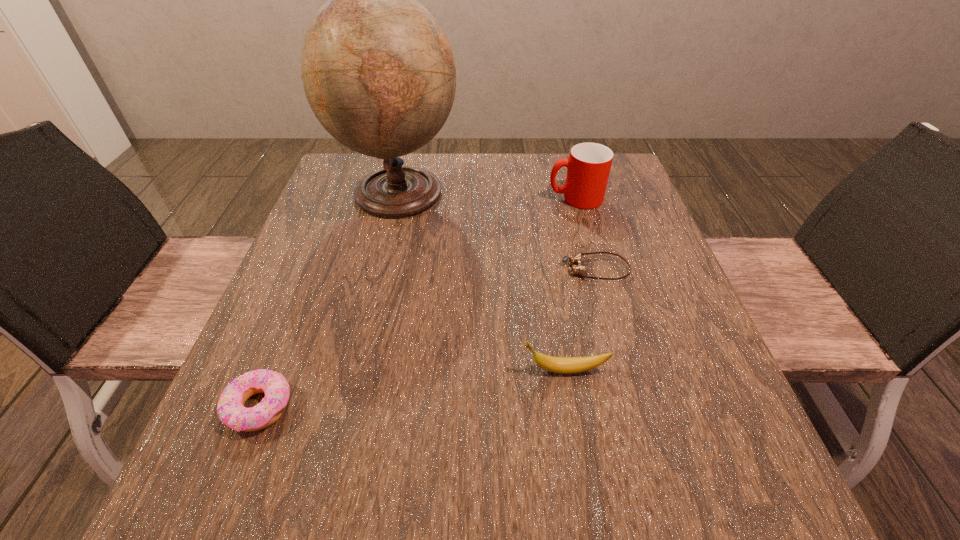
Find the location of a particular element. globe is located at coordinates (378, 71).

What are the coordinates of `cup` in the screenshot? It's located at (588, 167).

Where is `the second nearest object`? The height and width of the screenshot is (540, 960). the second nearest object is located at coordinates (567, 365).

Where is `the third tallest object`? the third tallest object is located at coordinates (567, 365).

Find the location of `the fourth tallest object`. the fourth tallest object is located at coordinates (230, 408).

You are a GUI agent. You are given a task and a screenshot of the screen. Output one action in this format:
    pyautogui.click(x=<x>, y=<y>)
    Task: Click on the doughnut
    
    Given the screenshot: What is the action you would take?
    pyautogui.click(x=230, y=408)

This screenshot has width=960, height=540. Identify the location of the third nearest object. (575, 260).

Find the location of a particular element. Image resolution: width=960 pixels, height=540 pixels. the shortest object is located at coordinates (575, 260).

Locate an element on the screen. vacant position located on the front-facing side of the tallest object is located at coordinates (579, 191).

Find the location of a particular element. The width and height of the screenshot is (960, 540). free space located 0.110m on the side of the second tallest object with the handle is located at coordinates (505, 198).